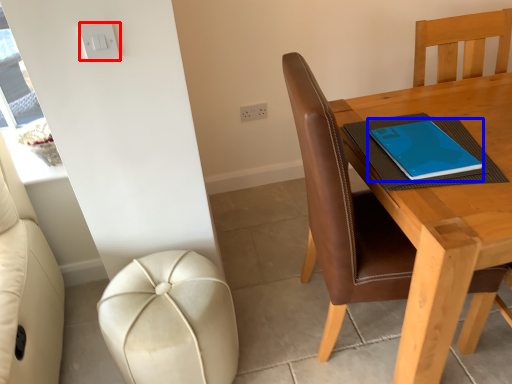
Question: Which of the following is the farthest to the observer, light switch (highlighted by a red box) or notebook (highlighted by a blue box)?

Choices:
 (A) light switch
 (B) notebook

Answer: (B)